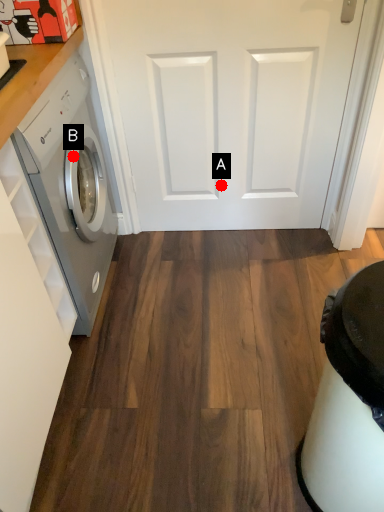
Question: Two points are circled on the image, labeled by A and B beside each circle. Which point is closer to the camera?

Choices:
 (A) A is closer
 (B) B is closer

Answer: (B)